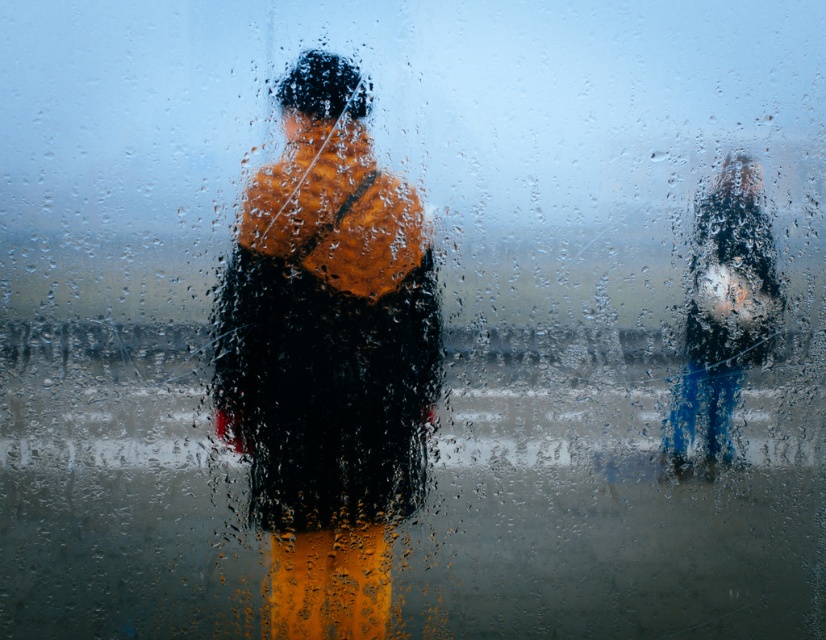
Is orange fabric jacket at center bigger than shiny black jacket at right?

Correct, orange fabric jacket at center is larger in size than shiny black jacket at right.

Is orange fabric jacket at center wider than shiny black jacket at right?

Yes.

Identify the location of orange fabric jacket at center. (326, 356).